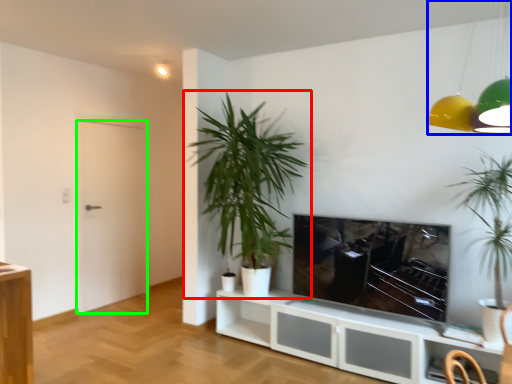
Question: Which object is the farthest from houseplant (highlighted by a red box)? Choose among these: lamp (highlighted by a blue box) or door (highlighted by a green box).

Choices:
 (A) lamp
 (B) door

Answer: (A)